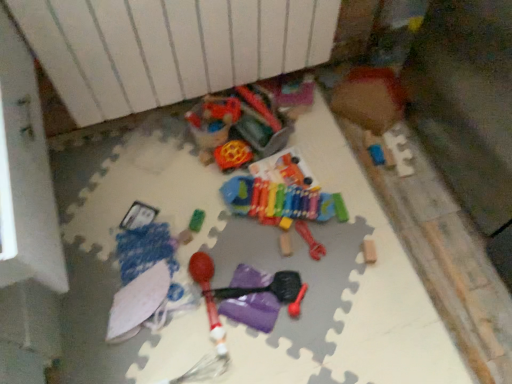
Find the location of a particular element. The width and height of the screenshot is (512, 384). purple plastic hammer at center, which appears as the 1th toy when ordered from the bottom is located at coordinates (271, 291).

What do you see at coordinates (233, 155) in the screenshot? This screenshot has height=384, width=512. I see `rubberized plastic ball at center, the eighth toy positioned from the bottom` at bounding box center [233, 155].

Describe the element at coordinates (137, 302) in the screenshot. I see `white matte umbrella at lower left, arranged as the second toy when ordered from the bottom` at that location.

Locate an element on the screen. The width and height of the screenshot is (512, 384). rubber chew toy at center, the 5th toy in the top-to-bottom sequence is located at coordinates (310, 240).

Describe the element at coordinates (281, 196) in the screenshot. I see `multicolored plastic xylophone at center, which is the 7th toy in bottom-to-top order` at that location.

Locate an element on the screen. This screenshot has width=512, height=384. wooden block at center, which is the sixth toy in top-to-bottom order is located at coordinates (285, 244).

The height and width of the screenshot is (384, 512). I want to click on purple plastic hammer at center, the 9th toy when ordered from top to bottom, so click(271, 291).

How different are the orientations of wooden puzzle piece at upper right, the ninth toy from the bottom, and wooden block at center, which is the sixth toy in top-to-bottom order, in degrees?

They differ by 6.38 degrees in their facing directions.

Is wooden puzzle piece at upper right, the first toy viewed from the top, not within wooden block at center, which is the sixth toy in top-to-bottom order?

wooden puzzle piece at upper right, the first toy viewed from the top, is positioned outside wooden block at center, which is the sixth toy in top-to-bottom order.

Is point (377, 130) behind point (287, 253)?

That is True.

Is wooden puzzle piece at upper right, the first toy viewed from the top, bigger than wooden block at center, which is the sixth toy in top-to-bottom order?

Correct, wooden puzzle piece at upper right, the first toy viewed from the top, is larger in size than wooden block at center, which is the sixth toy in top-to-bottom order.

From the image's perspective, is wooden block at center, the 4th toy when ordered from bottom to top, beneath wooden puzzle piece at upper right, the ninth toy from the bottom?

Yes.

From the picture: Is wooden block at center, which is the sixth toy in top-to-bottom order, taller or shorter than wooden puzzle piece at upper right, the first toy viewed from the top?

In the image, wooden block at center, which is the sixth toy in top-to-bottom order, appears to be shorter than wooden puzzle piece at upper right, the first toy viewed from the top.

Which is in front, point (283, 252) or point (359, 125)?

The point (283, 252) is more forward.

Are wooden block at center, which is the sixth toy in top-to-bottom order, and wooden puzzle piece at upper right, the ninth toy from the bottom, located far from each other?

They are positioned close to each other.

Looking at their sizes, would you say green rubber toy at center, which is the 4th toy from top to bottom, is wider or thinner than rubberized plastic ball at center, the eighth toy positioned from the bottom?

In the image, green rubber toy at center, which is the 4th toy from top to bottom, appears to be more narrow than rubberized plastic ball at center, the eighth toy positioned from the bottom.

Which object is positioned more to the left, green rubber toy at center, positioned as the 6th toy in bottom-to-top order, or rubberized plastic ball at center, which ranks as the 2th toy in top-to-bottom order?

Positioned to the left is green rubber toy at center, positioned as the 6th toy in bottom-to-top order.

Considering the positions of objects green rubber toy at center, which is the 4th toy from top to bottom, and rubberized plastic ball at center, the eighth toy positioned from the bottom, in the image provided, who is behind, green rubber toy at center, which is the 4th toy from top to bottom, or rubberized plastic ball at center, the eighth toy positioned from the bottom,?

Positioned behind is rubberized plastic ball at center, the eighth toy positioned from the bottom.

From the image's perspective, which object appears higher, green rubber toy at center, positioned as the 6th toy in bottom-to-top order, or rubberized plastic ball at center, which ranks as the 2th toy in top-to-bottom order?

rubberized plastic ball at center, which ranks as the 2th toy in top-to-bottom order, from the image's perspective.

Is wooden block at center, which is the sixth toy in top-to-bottom order, wider or thinner than green rubber toy at center, which is the 4th toy from top to bottom?

wooden block at center, which is the sixth toy in top-to-bottom order, is thinner than green rubber toy at center, which is the 4th toy from top to bottom.

Considering the sizes of objects wooden block at center, which is the sixth toy in top-to-bottom order, and green rubber toy at center, which is the 4th toy from top to bottom, in the image provided, who is taller, wooden block at center, which is the sixth toy in top-to-bottom order, or green rubber toy at center, which is the 4th toy from top to bottom,?

With more height is green rubber toy at center, which is the 4th toy from top to bottom.

The width and height of the screenshot is (512, 384). There is a green rubber toy at center, which is the 4th toy from top to bottom. What are the coordinates of `the 2nd toy below it (from the image's perspective)` in the screenshot? It's located at (285, 244).

Is wooden block at center, the 4th toy when ordered from bottom to top, bigger than green rubber toy at center, which is the 4th toy from top to bottom?

Incorrect, wooden block at center, the 4th toy when ordered from bottom to top, is not larger than green rubber toy at center, which is the 4th toy from top to bottom.

Is purple plastic hammer at center, which appears as the 1th toy when ordered from the bottom, beside rubber chew toy at center, acting as the 5th toy starting from the bottom?

No, purple plastic hammer at center, which appears as the 1th toy when ordered from the bottom, is not next to rubber chew toy at center, acting as the 5th toy starting from the bottom.

How much distance is there between purple plastic hammer at center, the 9th toy when ordered from top to bottom, and rubber chew toy at center, the 5th toy in the top-to-bottom sequence?

purple plastic hammer at center, the 9th toy when ordered from top to bottom, is 5.88 inches away from rubber chew toy at center, the 5th toy in the top-to-bottom sequence.

From a real-world perspective, is purple plastic hammer at center, the 9th toy when ordered from top to bottom, on top of rubber chew toy at center, the 5th toy in the top-to-bottom sequence?

Indeed, from a real-world perspective, purple plastic hammer at center, the 9th toy when ordered from top to bottom, stands above rubber chew toy at center, the 5th toy in the top-to-bottom sequence.

Locate an element on the screen. This screenshot has height=384, width=512. the 3rd toy to the left of the rubber chew toy at center, the 5th toy in the top-to-bottom sequence, counting from the anchor's position is located at coordinates (271, 291).

Is point (298, 232) farther from camera compared to point (204, 292)?

Yes.

Looking at this image, who is shorter, rubber chew toy at center, the 5th toy in the top-to-bottom sequence, or purple plastic hammer at center, the 9th toy when ordered from top to bottom?

With less height is rubber chew toy at center, the 5th toy in the top-to-bottom sequence.

Based on the photo, considering the sizes of objects rubber chew toy at center, the 5th toy in the top-to-bottom sequence, and purple plastic hammer at center, which appears as the 1th toy when ordered from the bottom, in the image provided, who is wider, rubber chew toy at center, the 5th toy in the top-to-bottom sequence, or purple plastic hammer at center, which appears as the 1th toy when ordered from the bottom,?

Wider between the two is rubber chew toy at center, the 5th toy in the top-to-bottom sequence.

Could you tell me if rubber chew toy at center, acting as the 5th toy starting from the bottom, is turned towards purple plastic hammer at center, which appears as the 1th toy when ordered from the bottom?

No, rubber chew toy at center, acting as the 5th toy starting from the bottom, does not turn towards purple plastic hammer at center, which appears as the 1th toy when ordered from the bottom.

From their relative heights in the image, would you say wooden puzzle piece at upper right, the first toy viewed from the top, is taller or shorter than rubberized plastic ball at center, the eighth toy positioned from the bottom?

Clearly, wooden puzzle piece at upper right, the first toy viewed from the top, is taller compared to rubberized plastic ball at center, the eighth toy positioned from the bottom.

Consider the image. From the image's perspective, which one is positioned higher, wooden puzzle piece at upper right, the ninth toy from the bottom, or rubberized plastic ball at center, the eighth toy positioned from the bottom?

wooden puzzle piece at upper right, the ninth toy from the bottom, is shown above in the image.

Is wooden puzzle piece at upper right, the first toy viewed from the top, facing away from rubberized plastic ball at center, the eighth toy positioned from the bottom?

wooden puzzle piece at upper right, the first toy viewed from the top, is not turned away from rubberized plastic ball at center, the eighth toy positioned from the bottom.

Is wooden puzzle piece at upper right, the first toy viewed from the top, far away from rubberized plastic ball at center, which ranks as the 2th toy in top-to-bottom order?

Actually, wooden puzzle piece at upper right, the first toy viewed from the top, and rubberized plastic ball at center, which ranks as the 2th toy in top-to-bottom order, are a little close together.

In order to click on toy that is the 5th one when counting upward from the wooden block at center, which is the sixth toy in top-to-bottom order (from the image's perspective) in this screenshot , I will do `click(370, 98)`.

Which toy is the 2nd one when counting from the right side of the wooden block at center, the 4th toy when ordered from bottom to top? Please provide its 2D coordinates.

[(370, 98)]

In the scene shown: Looking at the image, which one is located further to wooden block at center, which is the sixth toy in top-to-bottom order, wooden puzzle piece at upper right, the first toy viewed from the top, or rubberized plastic ball at center, the eighth toy positioned from the bottom?

wooden puzzle piece at upper right, the first toy viewed from the top, is further to wooden block at center, which is the sixth toy in top-to-bottom order.

Estimate the real-world distances between objects in this image. Which object is closer to rubber chew toy at center, acting as the 5th toy starting from the bottom, rubberized plastic ball at center, which ranks as the 2th toy in top-to-bottom order, or green rubber toy at center, positioned as the 6th toy in bottom-to-top order?

rubberized plastic ball at center, which ranks as the 2th toy in top-to-bottom order, is closer to rubber chew toy at center, acting as the 5th toy starting from the bottom.

Looking at the image, which one is located closer to green rubber toy at center, which is the 4th toy from top to bottom, rubberized plastic ball at center, which ranks as the 2th toy in top-to-bottom order, or rubber/maraca at center, positioned as the seventh toy in top-to-bottom order?

Based on the image, rubber/maraca at center, positioned as the seventh toy in top-to-bottom order, appears to be nearer to green rubber toy at center, which is the 4th toy from top to bottom.

Based on their spatial positions, is wooden block at center, which is the sixth toy in top-to-bottom order, or multicolored plastic xylophone at center, placed as the third toy when sorted from top to bottom, closer to white matte umbrella at lower left, arranged as the second toy when ordered from the bottom?

multicolored plastic xylophone at center, placed as the third toy when sorted from top to bottom.

Which object lies nearer to the anchor point rubber/maraca at center, the 3th toy when ordered from bottom to top, rubberized plastic ball at center, which ranks as the 2th toy in top-to-bottom order, or wooden block at center, the 4th toy when ordered from bottom to top?

wooden block at center, the 4th toy when ordered from bottom to top.

Looking at the image, which one is located further to multicolored plastic xylophone at center, which is the 7th toy in bottom-to-top order, rubber chew toy at center, the 5th toy in the top-to-bottom sequence, or wooden block at center, the 4th toy when ordered from bottom to top?

Among the two, wooden block at center, the 4th toy when ordered from bottom to top, is located further to multicolored plastic xylophone at center, which is the 7th toy in bottom-to-top order.

Based on their spatial positions, is wooden puzzle piece at upper right, the first toy viewed from the top, or white matte umbrella at lower left, arranged as the second toy when ordered from the bottom, further from rubberized plastic ball at center, which ranks as the 2th toy in top-to-bottom order?

wooden puzzle piece at upper right, the first toy viewed from the top, is further to rubberized plastic ball at center, which ranks as the 2th toy in top-to-bottom order.

Estimate the real-world distances between objects in this image. Which object is further from green rubber toy at center, which is the 4th toy from top to bottom, wooden block at center, which is the sixth toy in top-to-bottom order, or rubberized plastic ball at center, which ranks as the 2th toy in top-to-bottom order?

Among the two, wooden block at center, which is the sixth toy in top-to-bottom order, is located further to green rubber toy at center, which is the 4th toy from top to bottom.